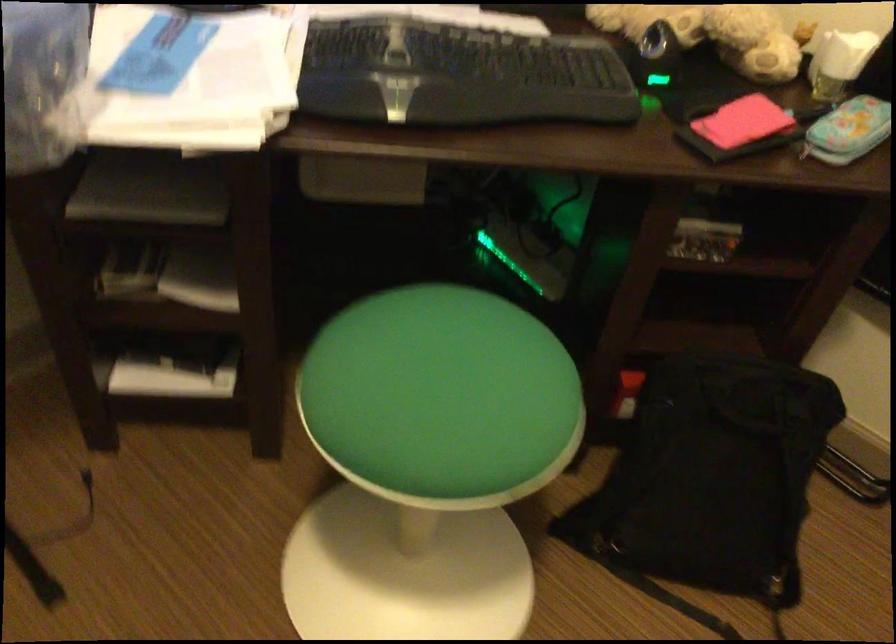
Where would you sitting on the green sitting surface? Please return your answer as a coordinate pair (x, y).

(441, 398)